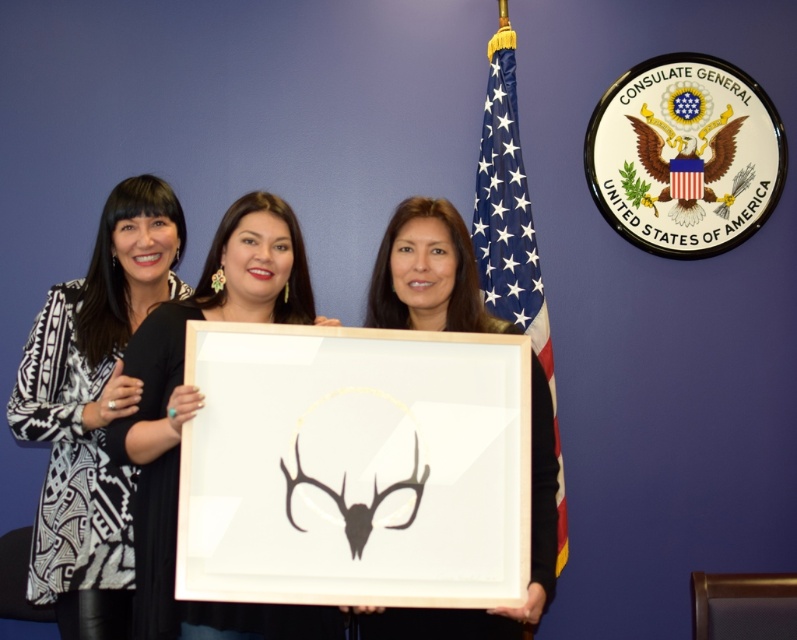
Which is more to the right, black printed fabric at left or american flag at center?

From the viewer's perspective, american flag at center appears more on the right side.

Is black printed fabric at left above american flag at center?

No.

I want to click on black printed fabric at left, so click(x=93, y=408).

Can you confirm if black printed fabric at left is thinner than black matte deer head at center?

No.

Who is more distant from viewer, [93,413] or [436,234]?

Positioned behind is point [93,413].

Where is `black printed fabric at left`? This screenshot has height=640, width=797. black printed fabric at left is located at coordinates (93, 408).

Is point (104, 376) behind point (279, 625)?

Yes, point (104, 376) is farther from viewer.

Who is lower down, black printed fabric at left or matte black frame at center?

Positioned lower is matte black frame at center.

Does point (61, 385) lie in front of point (324, 632)?

No, (61, 385) is further to viewer.

Find the location of a particular element. This screenshot has height=640, width=797. black printed fabric at left is located at coordinates 93,408.